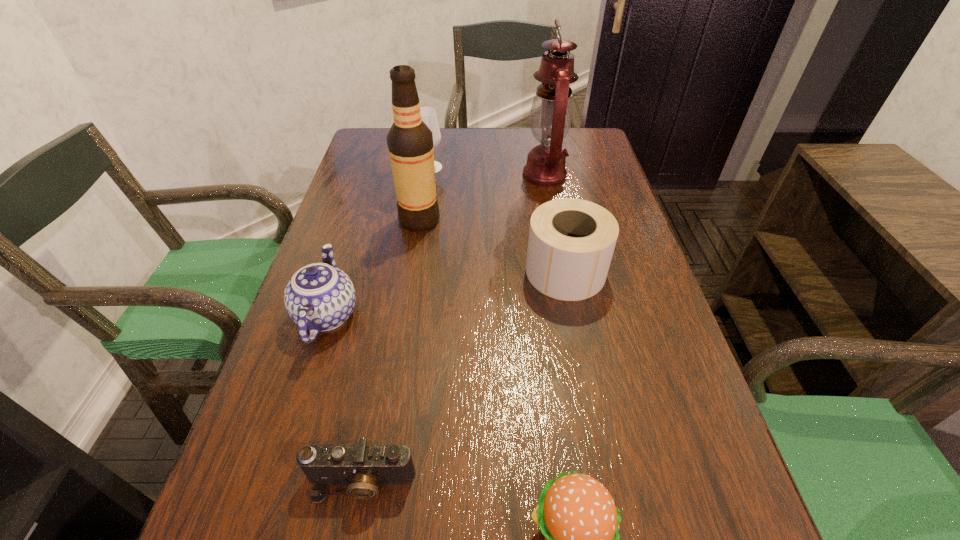
Locate an element on the screen. vacant area at the far edge is located at coordinates (486, 132).

You are a GUI agent. You are given a task and a screenshot of the screen. Output one action in this format:
    pyautogui.click(x=<x>, y=<y>)
    Task: Click on the vacant space at the left edge of the desktop
    
    Given the screenshot: What is the action you would take?
    pyautogui.click(x=358, y=301)

In order to click on free region at the right edge of the desktop in this screenshot , I will do `click(609, 330)`.

The height and width of the screenshot is (540, 960). I want to click on free area in between the third tallest object and the camera, so click(x=396, y=325).

Locate an element on the screen. The width and height of the screenshot is (960, 540). vacant area that lies between the shortest object and the oil lamp is located at coordinates (453, 328).

The width and height of the screenshot is (960, 540). Identify the location of blank region between the oil lamp and the chinaware. (436, 245).

The image size is (960, 540). Identify the location of vacant space in between the third farthest object and the camera. (390, 351).

The width and height of the screenshot is (960, 540). What are the coordinates of `free spot between the alcohol and the chinaware` in the screenshot? It's located at (373, 267).

This screenshot has height=540, width=960. I want to click on free space between the glass and the chinaware, so click(378, 241).

This screenshot has width=960, height=540. Identify the location of the sixth closest object to the chinaware. (551, 114).